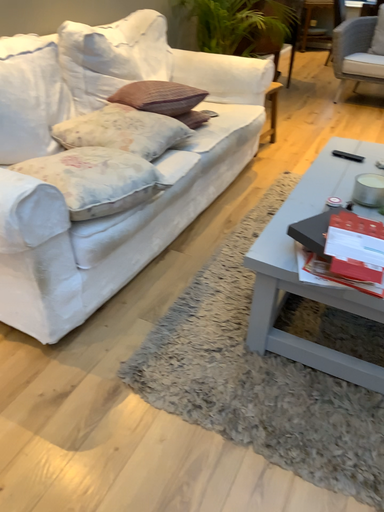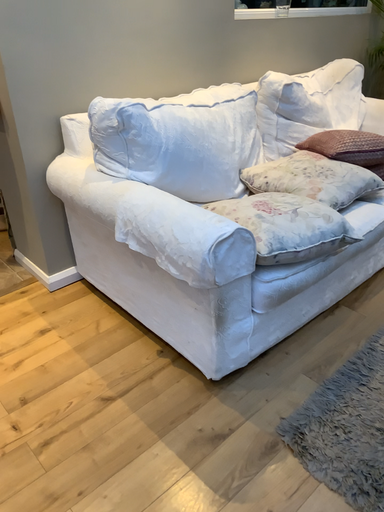
Question: How did the camera likely rotate when shooting the video?

Choices:
 (A) rotated right
 (B) rotated left

Answer: (B)